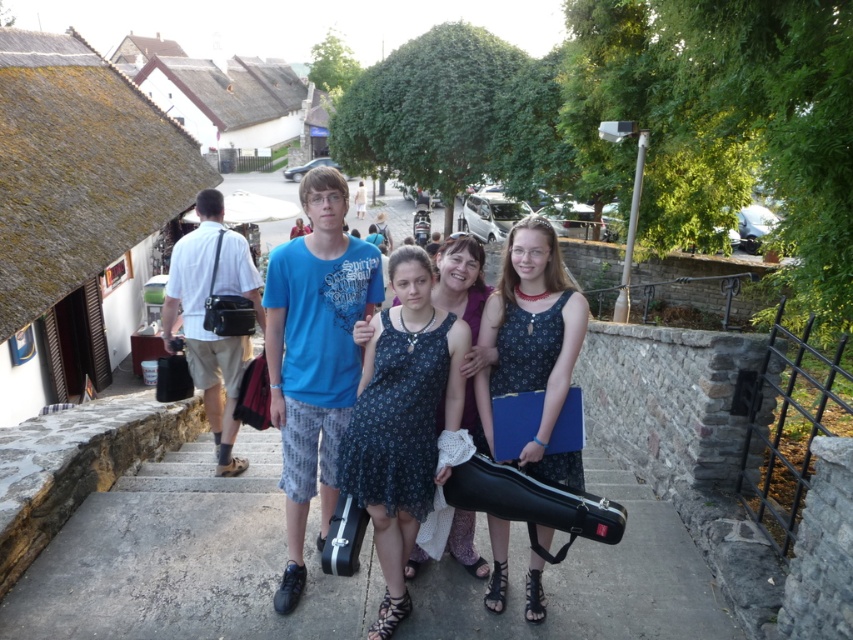
Is dark blue floral dress at center thinner than matte black guitar case at center?

No.

Can you confirm if dark blue floral dress at center is positioned above matte black guitar case at center?

No.

Is point (401, 276) behind point (525, 339)?

No, it is not.

At what (x,y) coordinates should I click in order to perform the action: click on dark blue floral dress at center. Please return your answer as a coordinate pair (x, y). The width and height of the screenshot is (853, 640). Looking at the image, I should click on (402, 420).